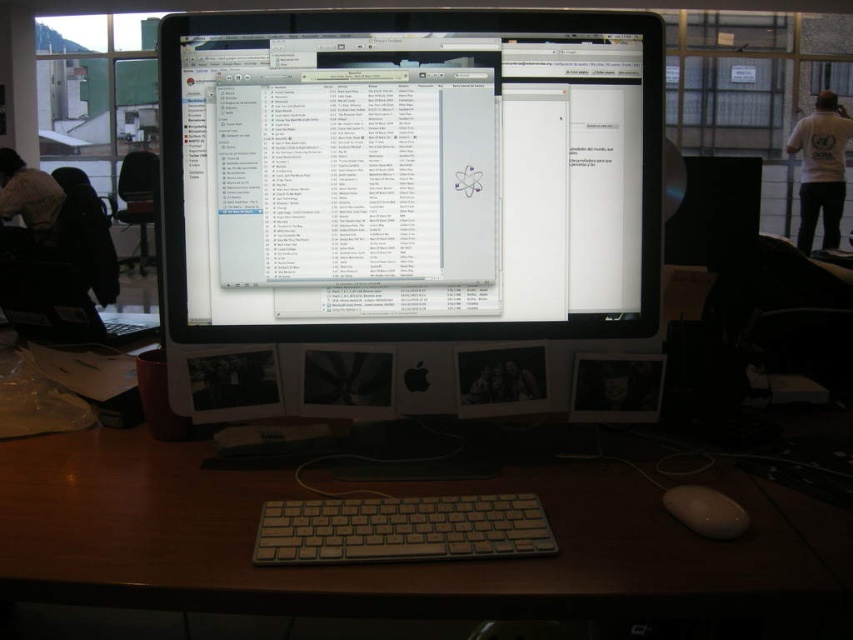
Is point (397, 515) positioned behind point (733, 508)?

No.

Is point (322, 500) closer to camera compared to point (695, 512)?

No, it is not.

Which is in front, point (465, 500) or point (711, 492)?

Point (465, 500) is in front.

Where is `white plastic keyboard at center`? The height and width of the screenshot is (640, 853). white plastic keyboard at center is located at coordinates (401, 529).

Does satin black monitor at center appear on the left side of white matte mouse at lower right?

Indeed, satin black monitor at center is positioned on the left side of white matte mouse at lower right.

How far apart are satin black monitor at center and white matte mouse at lower right?

The distance of satin black monitor at center from white matte mouse at lower right is 16.02 inches.

Where is `satin black monitor at center`? Image resolution: width=853 pixels, height=640 pixels. satin black monitor at center is located at coordinates (402, 202).

Does satin black monitor at center have a smaller size compared to white fabric shirt at left?

Indeed, satin black monitor at center has a smaller size compared to white fabric shirt at left.

Based on the photo, who is more distant from viewer, (519,312) or (36,221)?

Point (36,221)

The width and height of the screenshot is (853, 640). What are the coordinates of `satin black monitor at center` in the screenshot? It's located at click(402, 202).

Find the location of a particular element. This screenshot has height=640, width=853. satin black monitor at center is located at coordinates pyautogui.click(x=402, y=202).